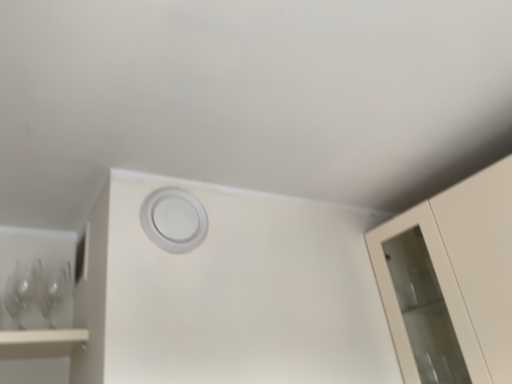
Question: From a real-world perspective, does white matte circle at center stand above transparent glass wine glass at left, positioned as the first wine glass in left-to-right order?

Choices:
 (A) yes
 (B) no

Answer: (A)

Question: Is white matte circle at center at the left side of transparent glass wine glass at left, positioned as the first wine glass in left-to-right order?

Choices:
 (A) no
 (B) yes

Answer: (A)

Question: Considering the relative sizes of white matte circle at center and transparent glass wine glass at left, marked as the 2th wine glass in a right-to-left arrangement, in the image provided, is white matte circle at center taller than transparent glass wine glass at left, marked as the 2th wine glass in a right-to-left arrangement,?

Choices:
 (A) yes
 (B) no

Answer: (A)

Question: From a real-world perspective, is white matte circle at center beneath transparent glass wine glass at left, marked as the 2th wine glass in a right-to-left arrangement?

Choices:
 (A) yes
 (B) no

Answer: (B)

Question: Considering the relative sizes of white matte circle at center and transparent glass wine glass at left, marked as the 2th wine glass in a right-to-left arrangement, in the image provided, is white matte circle at center thinner than transparent glass wine glass at left, marked as the 2th wine glass in a right-to-left arrangement,?

Choices:
 (A) no
 (B) yes

Answer: (B)

Question: From a real-world perspective, is clear glass wine glass at left, marked as the 1th wine glass in a right-to-left arrangement, above or below white matte circle at center?

Choices:
 (A) below
 (B) above

Answer: (A)

Question: Is clear glass wine glass at left, the 2th wine glass from the left, wider or thinner than white matte circle at center?

Choices:
 (A) thin
 (B) wide

Answer: (B)

Question: In the image, is clear glass wine glass at left, marked as the 1th wine glass in a right-to-left arrangement, on the left side or the right side of white matte circle at center?

Choices:
 (A) right
 (B) left

Answer: (B)

Question: From the image's perspective, relative to white matte circle at center, is clear glass wine glass at left, the 2th wine glass from the left, above or below?

Choices:
 (A) below
 (B) above

Answer: (A)

Question: Is white matte circle at center wider or thinner than clear glass wine glass at left, marked as the 1th wine glass in a right-to-left arrangement?

Choices:
 (A) thin
 (B) wide

Answer: (A)

Question: Is white matte circle at center to the left or to the right of clear glass wine glass at left, the 2th wine glass from the left, in the image?

Choices:
 (A) right
 (B) left

Answer: (A)

Question: Would you say white matte circle at center is inside or outside clear glass wine glass at left, marked as the 1th wine glass in a right-to-left arrangement?

Choices:
 (A) inside
 (B) outside

Answer: (B)

Question: From their relative heights in the image, would you say white matte circle at center is taller or shorter than clear glass wine glass at left, marked as the 1th wine glass in a right-to-left arrangement?

Choices:
 (A) short
 (B) tall

Answer: (B)

Question: Considering the positions of transparent glass wine glass at left, marked as the 2th wine glass in a right-to-left arrangement, and white matte circle at center in the image, is transparent glass wine glass at left, marked as the 2th wine glass in a right-to-left arrangement, wider or thinner than white matte circle at center?

Choices:
 (A) wide
 (B) thin

Answer: (A)

Question: In terms of height, does transparent glass wine glass at left, positioned as the first wine glass in left-to-right order, look taller or shorter compared to white matte circle at center?

Choices:
 (A) short
 (B) tall

Answer: (A)